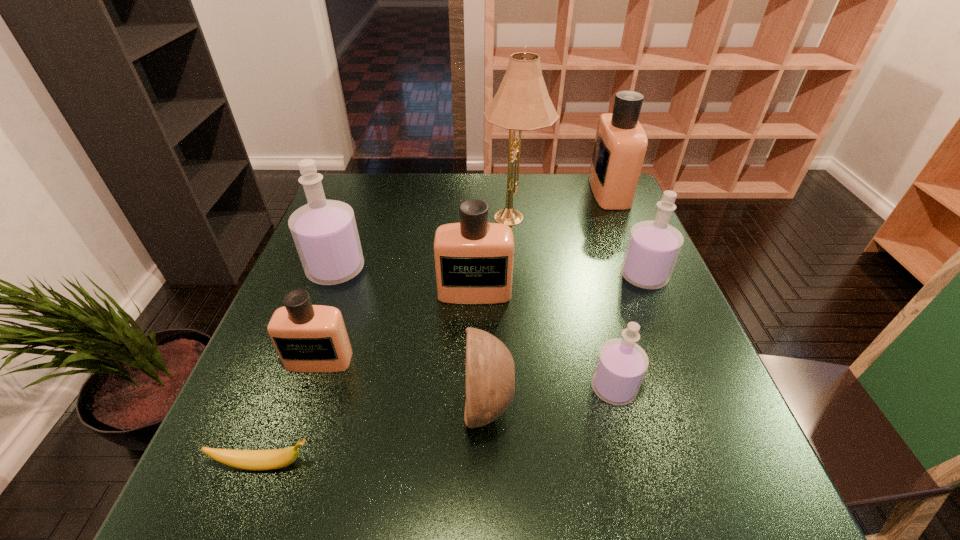
This screenshot has width=960, height=540. Find the location of `the leftmost beige perfume`. the leftmost beige perfume is located at coordinates (308, 338).

The image size is (960, 540). I want to click on the smallest beige perfume, so click(308, 338).

At what (x,y) coordinates should I click in order to perform the action: click on bowl. Please return your answer as a coordinate pair (x, y). Looking at the image, I should click on (490, 374).

At what (x,y) coordinates should I click in order to perform the action: click on yellow banana. Please return your answer as a coordinate pair (x, y). The width and height of the screenshot is (960, 540). Looking at the image, I should click on (255, 460).

Identify the location of the shortest object. The height and width of the screenshot is (540, 960). (255, 460).

At what (x,y) coordinates should I click in order to perform the action: click on vacant space located 0.050m on the back of the lampshade. Please return your answer as a coordinate pair (x, y). Image resolution: width=960 pixels, height=540 pixels. Looking at the image, I should click on (513, 191).

Image resolution: width=960 pixels, height=540 pixels. I want to click on free space located on the front label of the farthest beige perfume, so click(x=564, y=191).

What are the coordinates of `free spot located 0.070m on the front label of the farthest beige perfume` in the screenshot? It's located at (569, 191).

This screenshot has height=540, width=960. Identify the location of free space located 0.240m on the front label of the farthest beige perfume. (516, 191).

Identify the location of vacant point located 0.380m on the back of the biggest purple perfume. This screenshot has height=540, width=960. (370, 179).